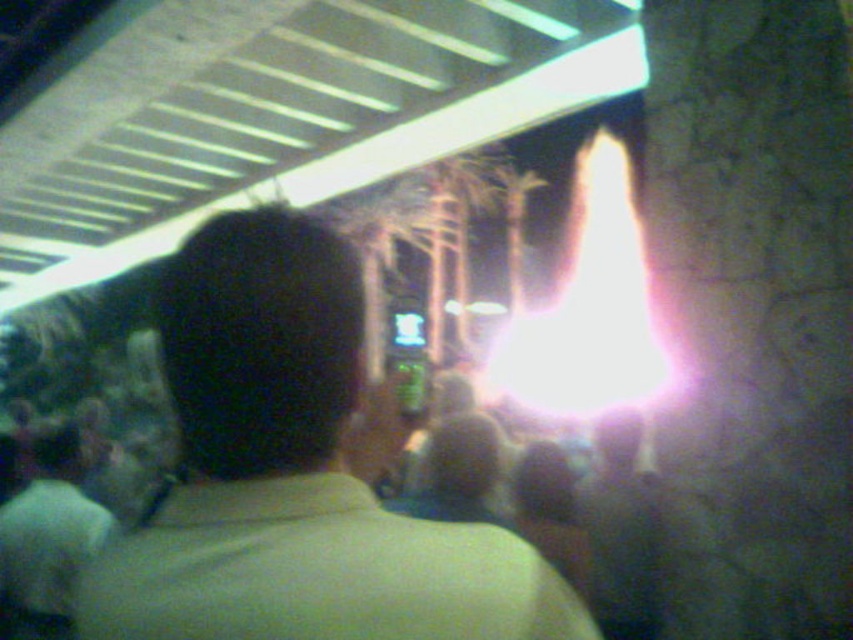
How much distance is there between light brown fabric shirt at center and light green shirt at lower left?

They are 2.40 meters apart.

Between point (206, 458) and point (54, 627), which one is positioned in front?

Positioned in front is point (206, 458).

You are a GUI agent. You are given a task and a screenshot of the screen. Output one action in this format:
    pyautogui.click(x=<x>, y=<y>)
    Task: Click on the light brown fabric shirt at center
    This screenshot has width=853, height=640.
    Given the screenshot: What is the action you would take?
    pyautogui.click(x=294, y=474)

Image resolution: width=853 pixels, height=640 pixels. Identify the location of light brown fabric shirt at center. (294, 474).